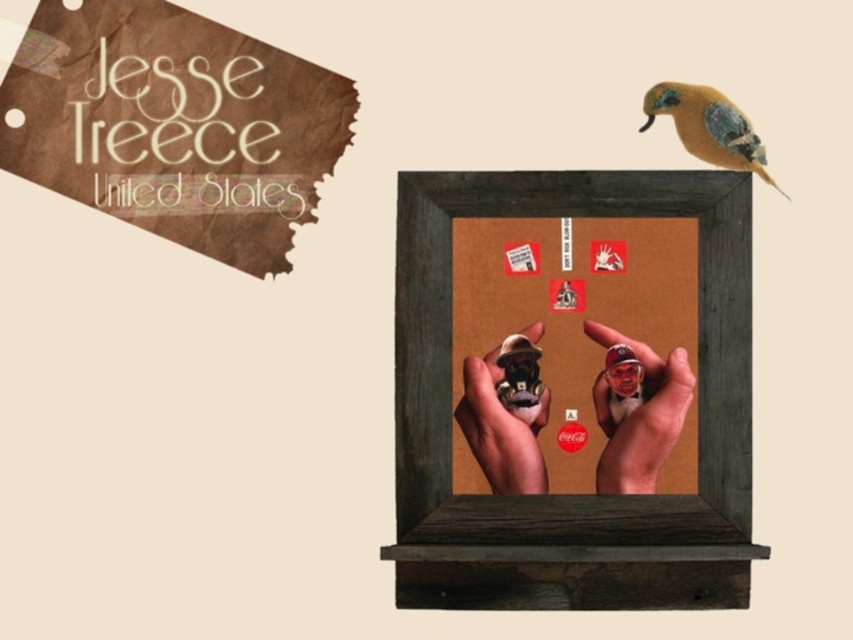
Based on the photo, does brown wooden picture frame at center lie in front of smooth plastic hand at center?

Yes, brown wooden picture frame at center is in front of smooth plastic hand at center.

What do you see at coordinates (579, 497) in the screenshot?
I see `brown wooden picture frame at center` at bounding box center [579, 497].

Find the location of a particular element. The image size is (853, 640). brown wooden picture frame at center is located at coordinates (579, 497).

From the picture: Between brown paper at upper left and matte brown figurine at center, which one is positioned lower?

Positioned lower is matte brown figurine at center.

Is brown paper at upper left wider than matte brown figurine at center?

Indeed, brown paper at upper left has a greater width compared to matte brown figurine at center.

Where is `brown paper at upper left`? brown paper at upper left is located at coordinates (173, 125).

Is brown wooden picture frame at center positioned in front of orange feathered bird at upper right?

Yes, it is in front of orange feathered bird at upper right.

Which is more to the left, brown wooden picture frame at center or orange feathered bird at upper right?

From the viewer's perspective, brown wooden picture frame at center appears more on the left side.

Is point (466, 564) positioned after point (705, 100)?

No.

Identify the location of brown wooden picture frame at center. Image resolution: width=853 pixels, height=640 pixels. (579, 497).